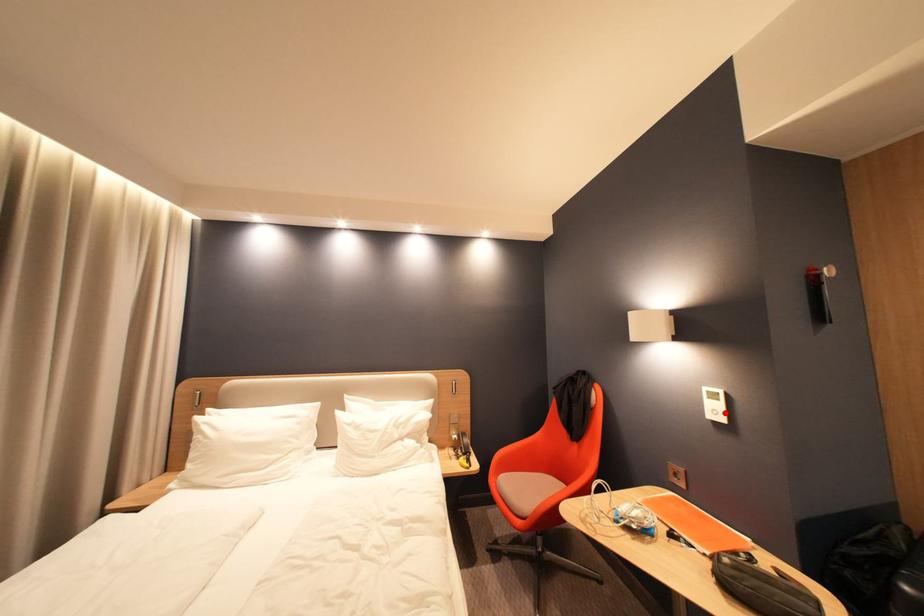
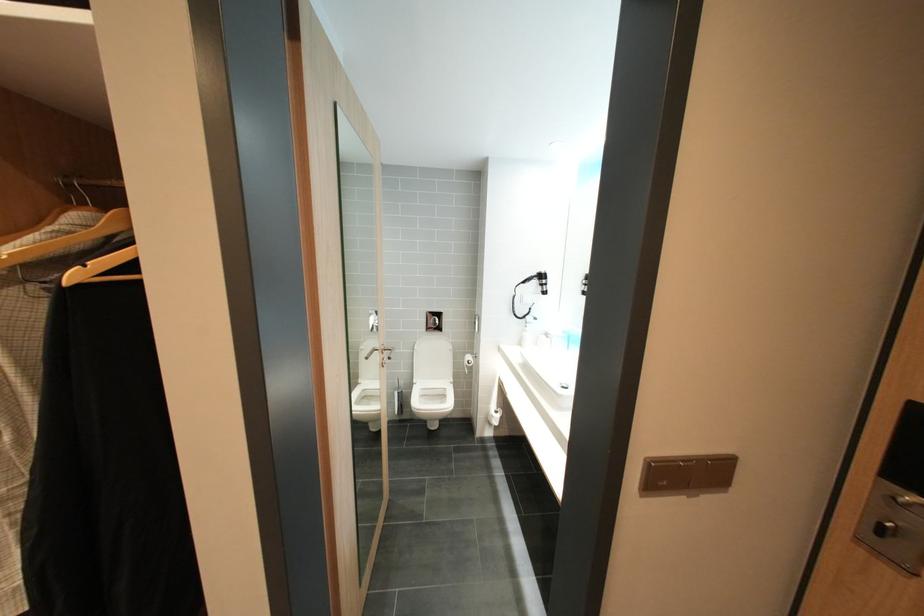
Question: I am providing you with two images of the same scene from different viewpoints. A red point is marked on the first image. At the location where the point appears in image 1, is it still visible in image 2?

Choices:
 (A) Yes
 (B) No

Answer: (B)